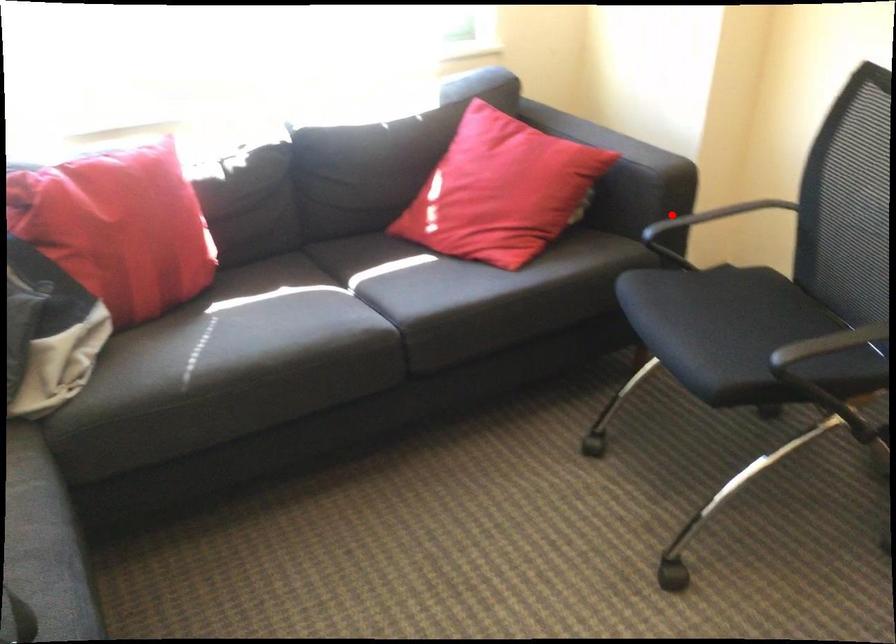
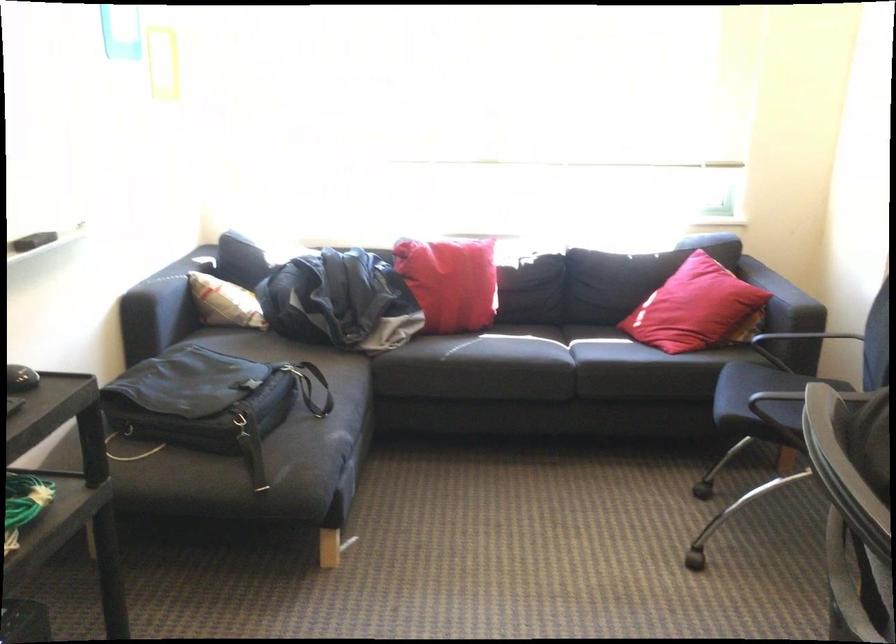
Question: A red point is marked in image1. In image2, is the corresponding 3D point closer to the camera or farther? Reply with the corresponding letter.

Choices:
 (A) The corresponding 3D point is closer.
 (B) The corresponding 3D point is farther.

Answer: (B)